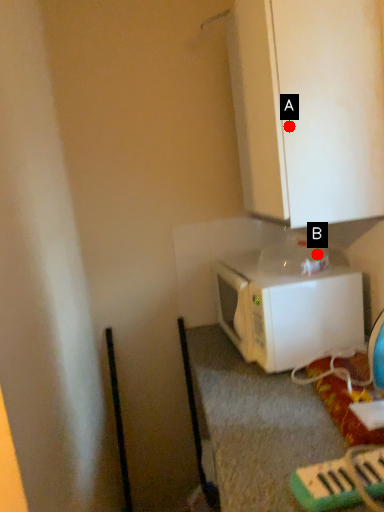
Question: Two points are circled on the image, labeled by A and B beside each circle. Which point appears farthest from the camera in this image?

Choices:
 (A) A is further
 (B) B is further

Answer: (B)